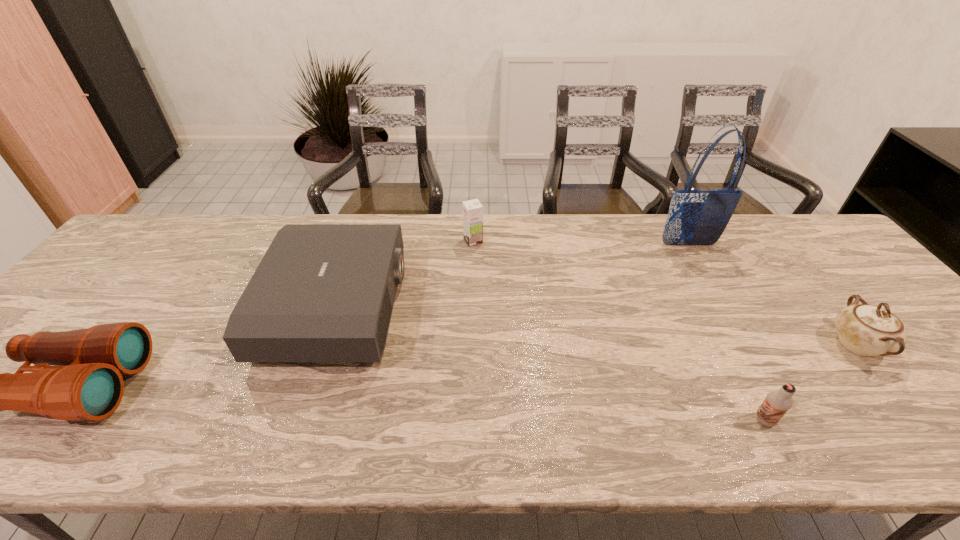
Identify the location of the tallest object. The width and height of the screenshot is (960, 540). (695, 217).

Locate an element on the screen. The image size is (960, 540). the left chocolate milk is located at coordinates (472, 209).

Image resolution: width=960 pixels, height=540 pixels. Identify the location of the farther chocolate milk. (472, 209).

I want to click on projector, so click(322, 292).

The image size is (960, 540). What are the coordinates of `chinaware` in the screenshot? It's located at (867, 330).

I want to click on the shorter chocolate milk, so click(778, 402).

Locate an element on the screen. This screenshot has width=960, height=540. the right chocolate milk is located at coordinates (778, 402).

You are a GUI agent. You are given a task and a screenshot of the screen. Output one action in this format:
    pyautogui.click(x=<x>, y=<y>)
    Task: Click on the vacant space positioned on the front-facing side of the tallest object
    The width and height of the screenshot is (960, 540).
    Given the screenshot: What is the action you would take?
    pyautogui.click(x=725, y=308)

Find the location of `vacant space located 0.380m on the left of the taller chocolate milk`. vacant space located 0.380m on the left of the taller chocolate milk is located at coordinates (340, 241).

Where is `vacant space located on the front-facing side of the second object from left to right`? vacant space located on the front-facing side of the second object from left to right is located at coordinates (534, 307).